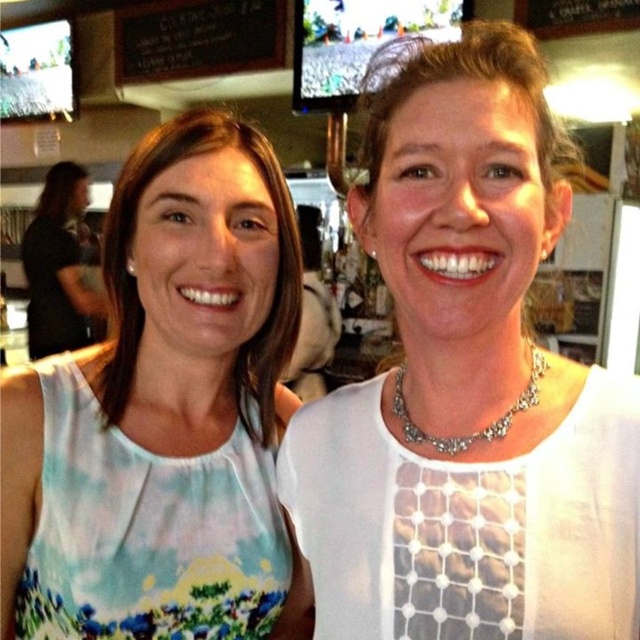
Who is positioned more to the left, blue tie-dye tank top at left or black chalkboard at upper center?

black chalkboard at upper center

Where is `blue tie-dye tank top at left`? This screenshot has height=640, width=640. blue tie-dye tank top at left is located at coordinates (195, 300).

What do you see at coordinates (467, 387) in the screenshot? The width and height of the screenshot is (640, 640). I see `white textured blouse at center` at bounding box center [467, 387].

Can you confirm if white textured blouse at center is positioned above blue tie-dye tank top at left?

Yes.

Which is in front, point (440, 452) or point (141, 186)?

Point (440, 452)

Find the location of a particular element. This screenshot has height=640, width=640. white textured blouse at center is located at coordinates (467, 387).

Describe the element at coordinates (467, 387) in the screenshot. I see `white textured blouse at center` at that location.

Does point (378, 488) come in front of point (58, 244)?

Yes, it is.

Locate an element on the screen. The width and height of the screenshot is (640, 640). white textured blouse at center is located at coordinates 467,387.